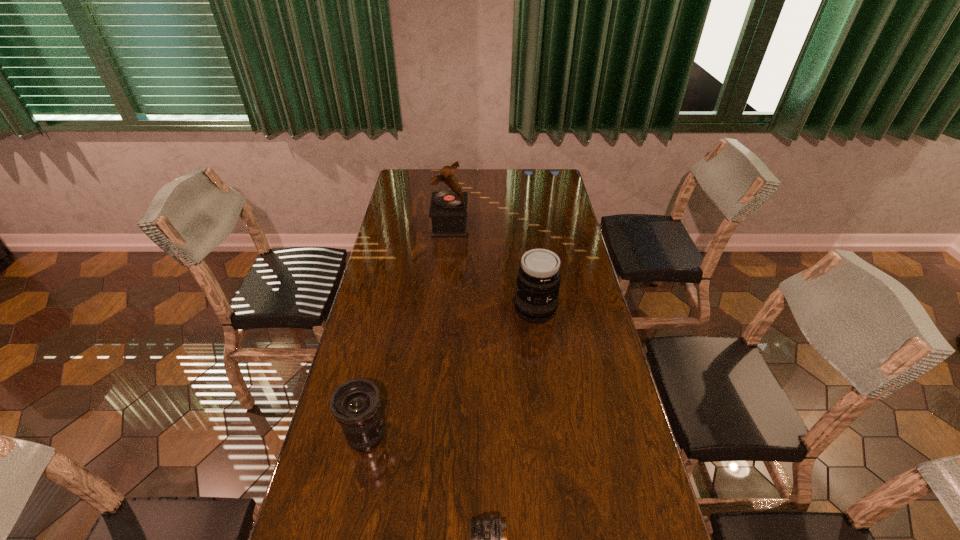
Where is `object situated at the right edge`? The height and width of the screenshot is (540, 960). object situated at the right edge is located at coordinates (536, 300).

At what (x,y) coordinates should I click in order to perform the action: click on free space at the far edge. Please return your answer as a coordinate pair (x, y). The image size is (960, 540). Looking at the image, I should click on (461, 174).

You are a GUI agent. You are given a task and a screenshot of the screen. Output one action in this format:
    pyautogui.click(x=<x>, y=<y>)
    Task: Click on the free space at the left edge of the desktop
    The image size is (960, 540).
    Given the screenshot: What is the action you would take?
    click(x=407, y=307)

Where is `vacant space at the right edge of the desktop`? The width and height of the screenshot is (960, 540). vacant space at the right edge of the desktop is located at coordinates [647, 524].

Where is `vacant space at the far left corner of the desktop`? The width and height of the screenshot is (960, 540). vacant space at the far left corner of the desktop is located at coordinates (402, 171).

Find the location of a particular element. The width and height of the screenshot is (960, 540). free space between the farthest telephoto lens and the third object from right to left is located at coordinates (492, 267).

Where is `free space between the third tallest object and the phonograph_record`? free space between the third tallest object and the phonograph_record is located at coordinates (408, 330).

The height and width of the screenshot is (540, 960). What are the coordinates of `vacant area that lies between the phonograph_record and the third tallest object` in the screenshot? It's located at (408, 330).

Image resolution: width=960 pixels, height=540 pixels. In order to click on unoccupied area between the farthest object and the second farthest telephoto lens in this screenshot , I will do `click(408, 330)`.

At what (x,y) coordinates should I click in order to perform the action: click on free point between the rightmost telephoto lens and the leftmost telephoto lens. Please return your answer as a coordinate pair (x, y). Looking at the image, I should click on (450, 373).